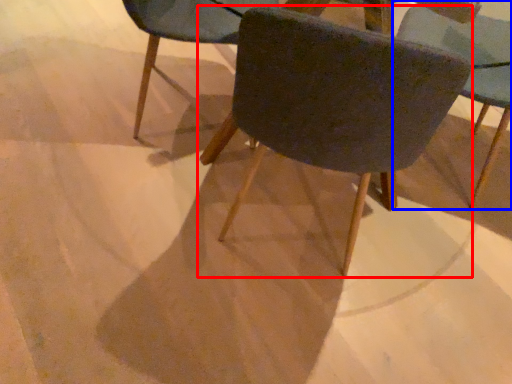
Question: Which object appears closest to the camera in this image, chair (highlighted by a red box) or chair (highlighted by a blue box)?

Choices:
 (A) chair
 (B) chair

Answer: (A)